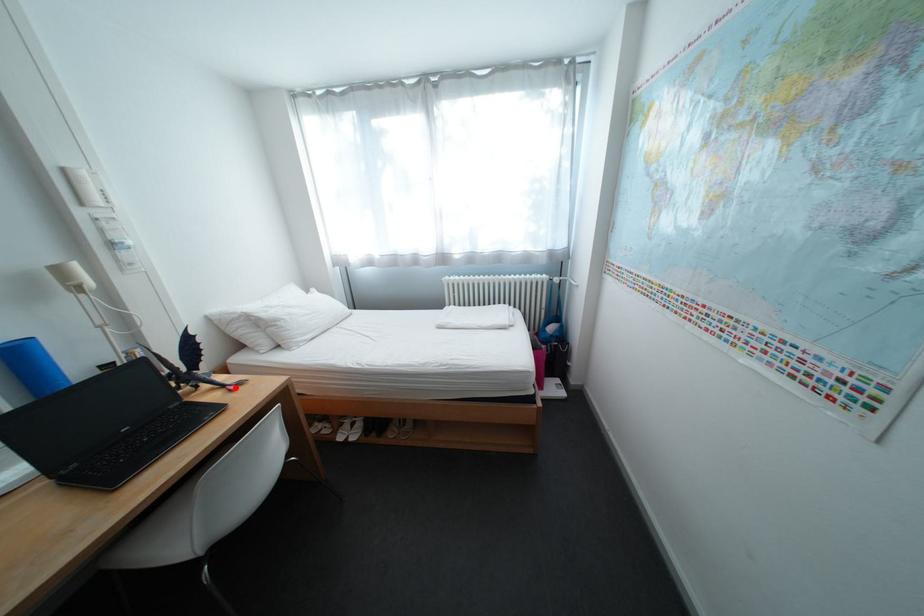
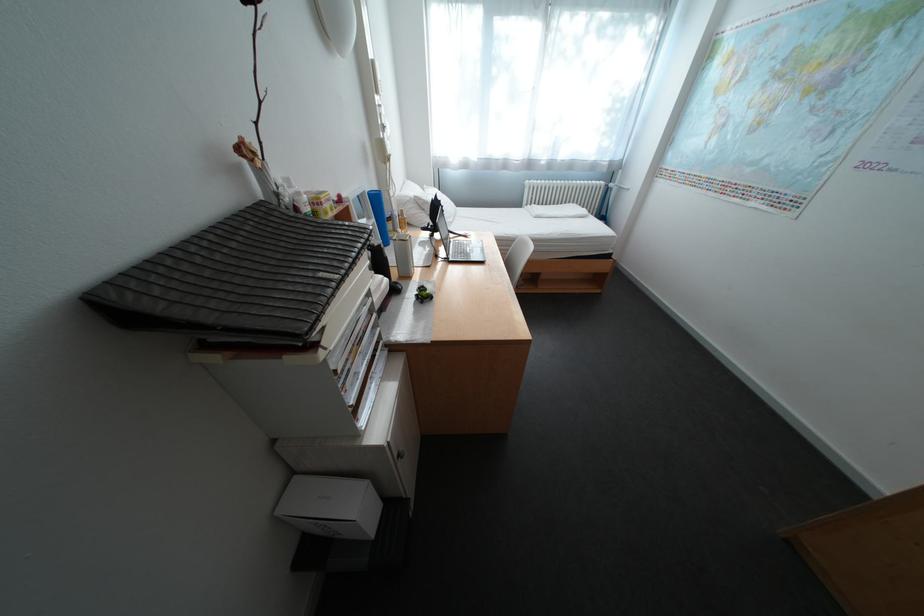
The point at the highlighted location is marked in the first image. Where is the corresponding point in the second image?

(472, 236)